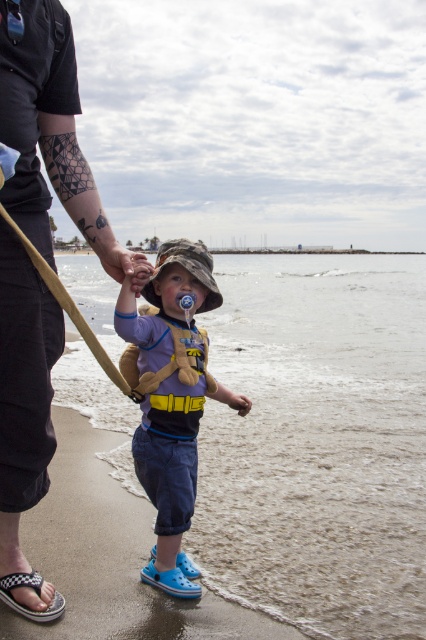
Question: Which point is farther to the camera?

Choices:
 (A) checkerboard fabric sandal at lower left
 (B) dark blue jeans at center

Answer: (A)

Question: Does dark blue jeans at center appear under matte blue shorts at center?

Choices:
 (A) no
 (B) yes

Answer: (A)

Question: From the image, what is the correct spatial relationship of dark blue jeans at center in relation to checkerboard fabric sandal at lower left?

Choices:
 (A) above
 (B) below

Answer: (A)

Question: Considering the real-world distances, which object is farthest from the checkerboard fabric sandal at lower left?

Choices:
 (A) dark blue jeans at center
 (B) matte blue shorts at center

Answer: (B)

Question: Is matte blue shorts at center thinner than checkerboard fabric sandal at lower left?

Choices:
 (A) yes
 (B) no

Answer: (B)

Question: Among these objects, which one is farthest from the camera?

Choices:
 (A) dark blue jeans at center
 (B) matte blue shorts at center

Answer: (B)